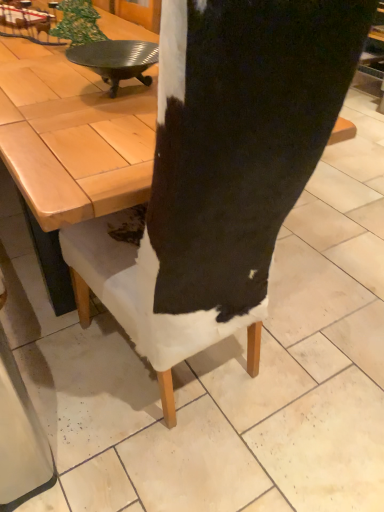
Locate an element on the screen. vacant area to the left of metallic silver plate at upper left is located at coordinates click(39, 86).